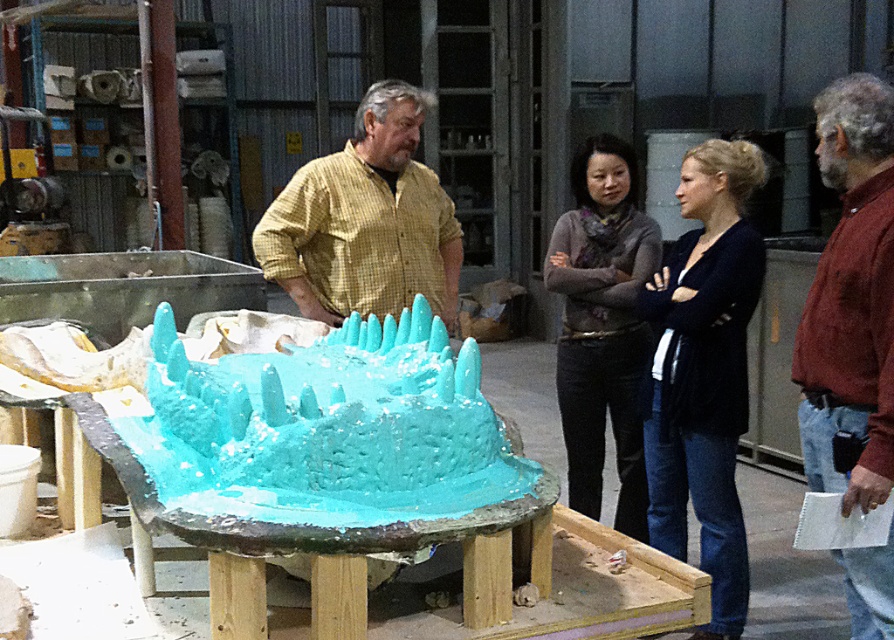
Can you confirm if black sweater at center is positioned to the right of knitted scarf at center?

Yes, black sweater at center is to the right of knitted scarf at center.

Who is taller, black sweater at center or knitted scarf at center?

With more height is black sweater at center.

Is point (731, 202) in front of point (596, 160)?

Yes, it is.

Find the location of a particular element. The width and height of the screenshot is (894, 640). black sweater at center is located at coordinates (704, 372).

Can you confirm if yellow checkered shirt at center is wider than knitted scarf at center?

Correct, the width of yellow checkered shirt at center exceeds that of knitted scarf at center.

Is point (280, 209) positioned in front of point (614, 525)?

Yes, point (280, 209) is in front of point (614, 525).

The image size is (894, 640). In order to click on yellow checkered shirt at center in this screenshot , I will do `click(365, 220)`.

Is turquoise clay sculpture at center positioned in front of maroon textured shirt at center right?

Yes, it is in front of maroon textured shirt at center right.

This screenshot has width=894, height=640. Identify the location of turquoise clay sculpture at center. (327, 428).

Based on the photo, who is more forward, (319, 352) or (867, 499)?

Point (867, 499) is in front.

What are the coordinates of `turquoise clay sculpture at center` in the screenshot? It's located at (327, 428).